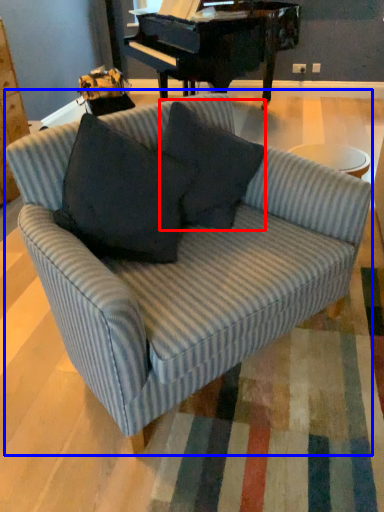
Question: Which object appears closest to the camera in this image, throw pillow (highlighted by a red box) or studio couch (highlighted by a blue box)?

Choices:
 (A) throw pillow
 (B) studio couch

Answer: (B)